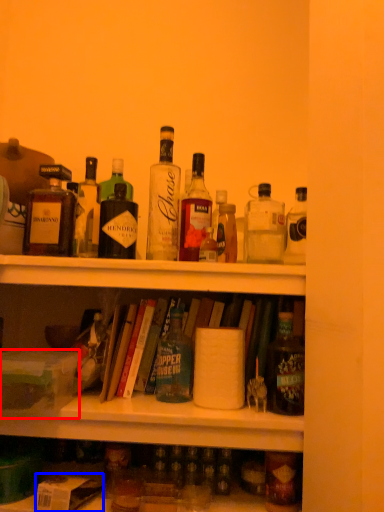
Question: Which of the following is the closest to the observer, box (highlighted by a red box) or box (highlighted by a blue box)?

Choices:
 (A) box
 (B) box

Answer: (B)